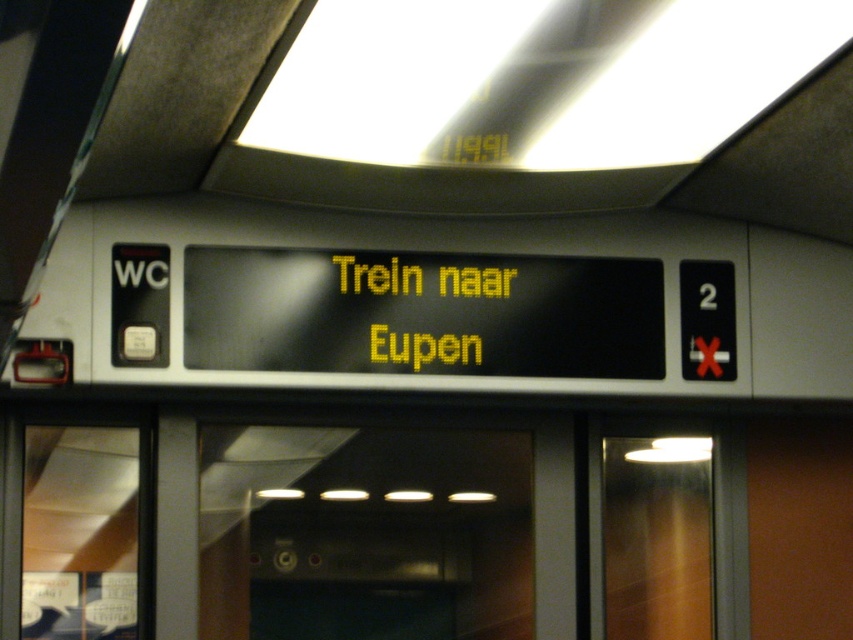
You are standing at the entrance of the train car and want to board the train to Eupen. The transparent glass door at center is the one you need to pass through. If your backpack is 1.5 meters long when fully extended, can you safely carry it through the doorway without tilting it?

The distance between the transparent glass door at center and the camera is 3.41 meters. Since your backpack is only 1.5 meters long when fully extended, there is sufficient space for you to carry it through the doorway without tilting it.

You are standing in the train car and want to know how far you are from the point marked as point (628, 451). Can you determine the distance?

The distance of point (628, 451) from the camera is 3.85 meters, so you are 3.85 meters away from that point.

You are a passenger on the train and want to exit through the doors. Since both transparent glass door at center and transparent glass door at right are open, which door should you use if you want to exit to the left side of the platform?

The transparent glass door at center is to the left of transparent glass door at right, so exiting through the transparent glass door at center would lead you to the left side of the platform.